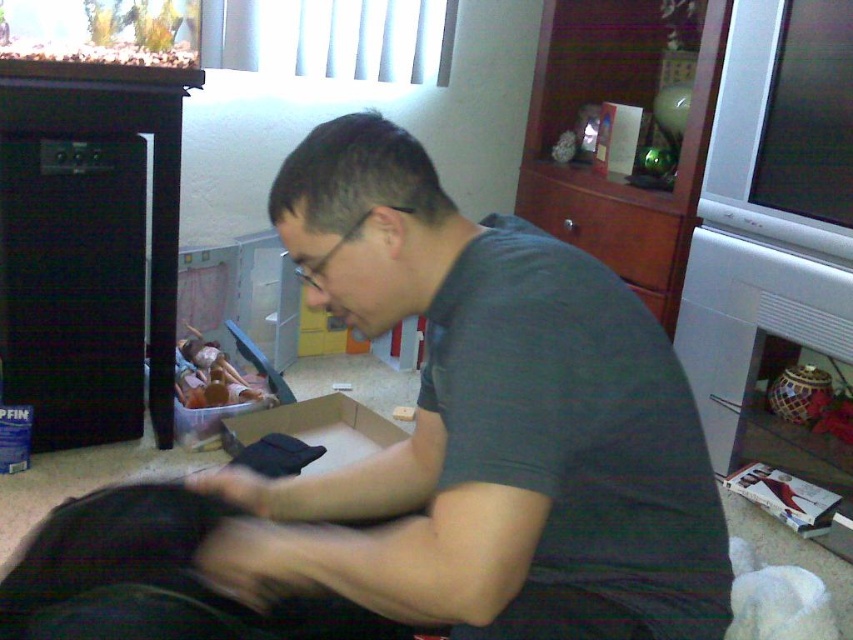
Question: Which point is closer to the camera taking this photo?

Choices:
 (A) tap(584, 292)
 (B) tap(67, 634)

Answer: (A)

Question: Can you confirm if dark gray t-shirt at center is positioned above black fabric bag at lower left?

Choices:
 (A) no
 (B) yes

Answer: (B)

Question: Among these points, which one is nearest to the camera?

Choices:
 (A) coord(384,330)
 (B) coord(409,636)

Answer: (A)

Question: Is dark gray t-shirt at center further to camera compared to black fabric bag at lower left?

Choices:
 (A) yes
 (B) no

Answer: (B)

Question: Is dark gray t-shirt at center above black fabric bag at lower left?

Choices:
 (A) yes
 (B) no

Answer: (A)

Question: Which of the following is the farthest from the observer?

Choices:
 (A) (231, 524)
 (B) (202, 516)

Answer: (B)